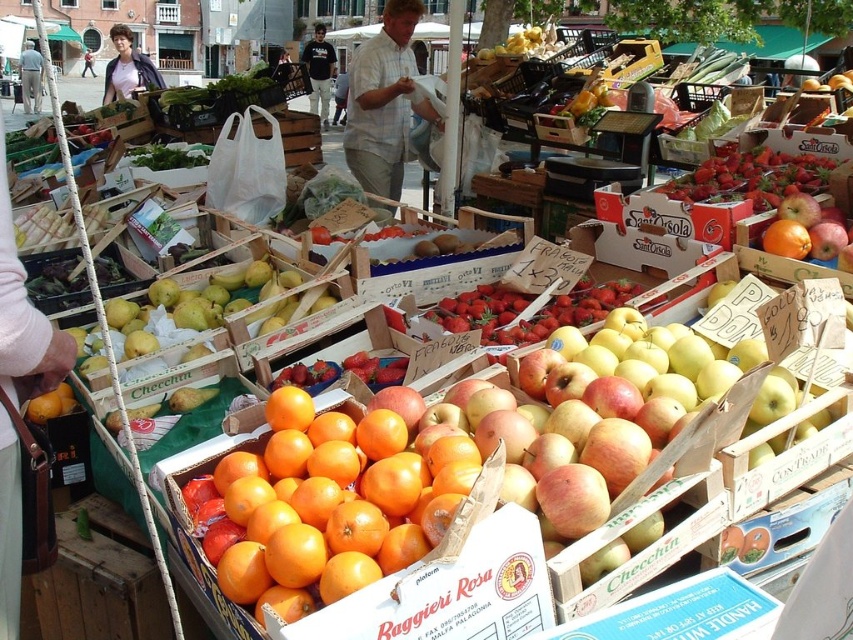
Question: Which of the following is the closest to the observer?

Choices:
 (A) (838, 221)
 (B) (184, 144)
 (C) (398, 29)

Answer: (A)

Question: Does light blue plaid shirt at center have a smaller size compared to green leafy at center?

Choices:
 (A) no
 (B) yes

Answer: (A)

Question: Is the position of matte white shirt at center more distant than that of light brown hair at center?

Choices:
 (A) no
 (B) yes

Answer: (A)

Question: Which object appears farthest from the camera in this image?

Choices:
 (A) light blue plaid shirt at center
 (B) shiny red apple at center
 (C) green leafy at center

Answer: (C)

Question: Which object is farther from the camera taking this photo?

Choices:
 (A) green leafy at center
 (B) green leafy vegetables at center
 (C) red matte strawberries at center
 (D) shiny red strawberries at center

Answer: (B)

Question: Can you confirm if light blue plaid shirt at center is positioned to the right of green leafy vegetables at center?

Choices:
 (A) yes
 (B) no

Answer: (A)